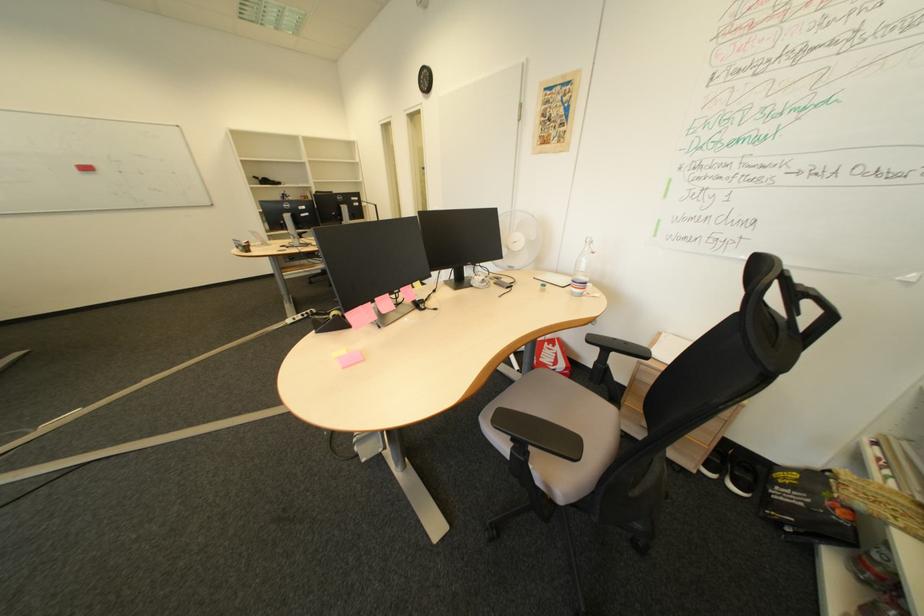
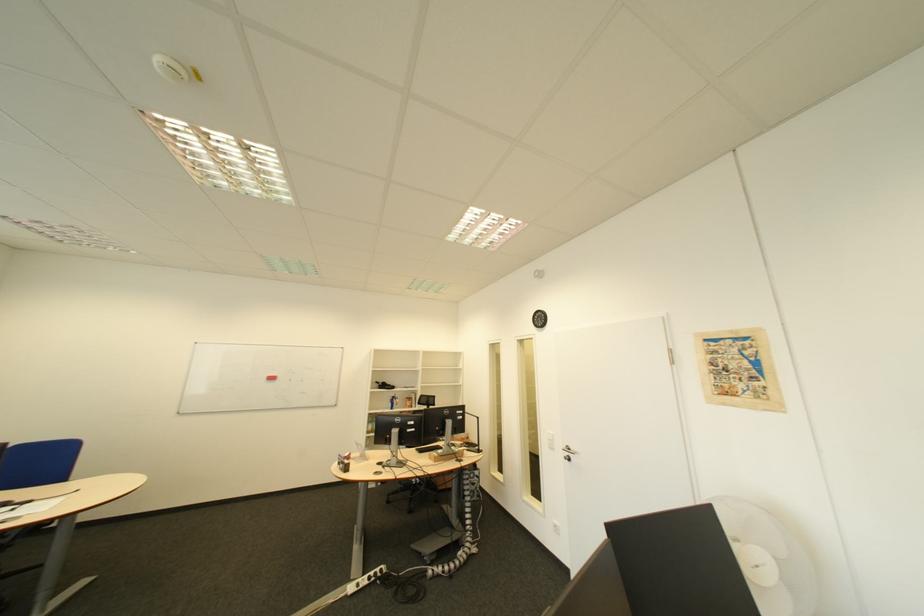
Find the pixel in the second image that matches point 101,169 in the first image.

(285, 379)